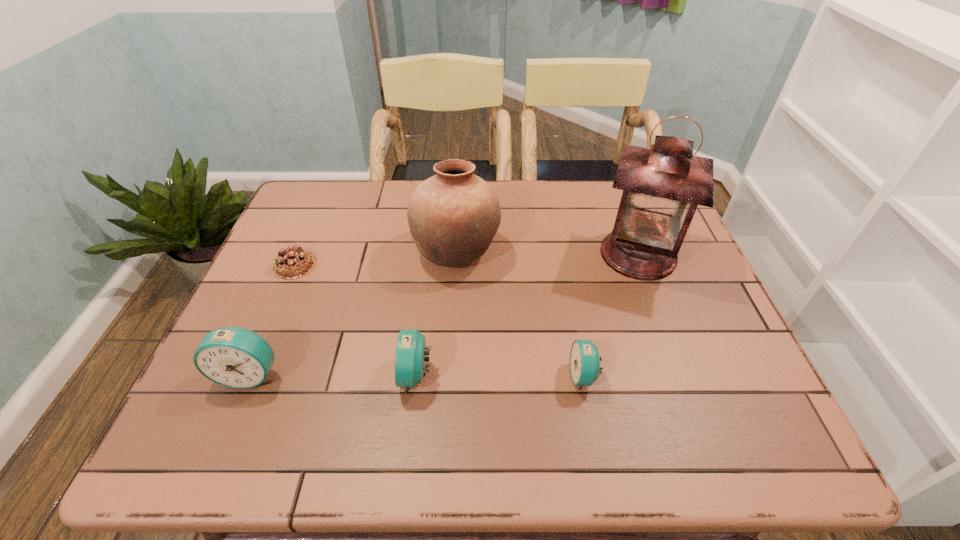
You are a GUI agent. You are given a task and a screenshot of the screen. Output one action in this format:
    pyautogui.click(x=<x>, y=<y>)
    Task: Click on the oil lamp that is at the far edge
    The height and width of the screenshot is (540, 960).
    Given the screenshot: What is the action you would take?
    pyautogui.click(x=662, y=186)

Find the location of a particular element. alarm clock present at the left edge is located at coordinates (235, 357).

Where is `chocolate cake that is positioned at the left edge`? The image size is (960, 540). chocolate cake that is positioned at the left edge is located at coordinates (291, 263).

This screenshot has height=540, width=960. Find the location of `object located at the right edge`. object located at the right edge is located at coordinates (662, 186).

Locate an element on the screen. The height and width of the screenshot is (540, 960). object at the near left corner is located at coordinates (235, 357).

Locate an element on the screen. Image resolution: width=960 pixels, height=540 pixels. object situated at the far right corner is located at coordinates (662, 186).

This screenshot has width=960, height=540. Identify the location of vacant space at the far edge. (568, 181).

The height and width of the screenshot is (540, 960). In the image, there is a desktop. What are the coordinates of `blank space at the near edge` in the screenshot? It's located at (463, 397).

In the image, there is a desktop. At what (x,y) coordinates should I click in order to perform the action: click on vacant space at the left edge. Please return your answer as a coordinate pair (x, y). This screenshot has width=960, height=540. Looking at the image, I should click on (282, 229).

In the image, there is a desktop. Where is `vacant space at the right edge`? Image resolution: width=960 pixels, height=540 pixels. vacant space at the right edge is located at coordinates (698, 318).